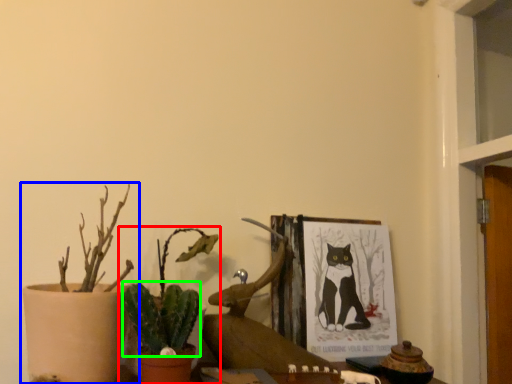
Question: Based on their relative distances, which object is nearer to houseplant (highlighted by a red box)? Choose from houseplant (highlighted by a blue box) and plant (highlighted by a green box).

Choices:
 (A) houseplant
 (B) plant

Answer: (B)